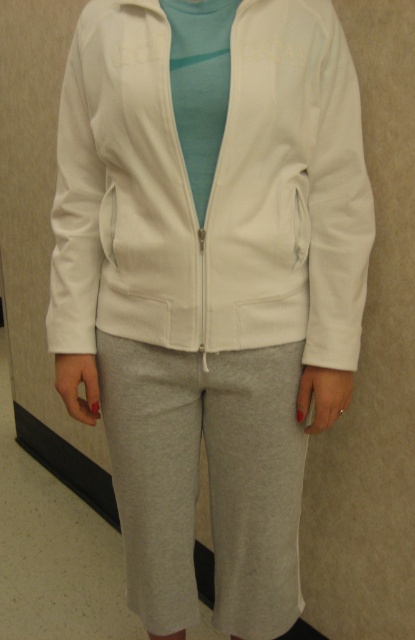
Is white smooth zip-up jacket at center above gray cotton pants at center?

Yes, white smooth zip-up jacket at center is above gray cotton pants at center.

In the scene shown: Can you confirm if white smooth zip-up jacket at center is bigger than gray cotton pants at center?

Indeed, white smooth zip-up jacket at center has a larger size compared to gray cotton pants at center.

The image size is (415, 640). I want to click on white smooth zip-up jacket at center, so [x=212, y=189].